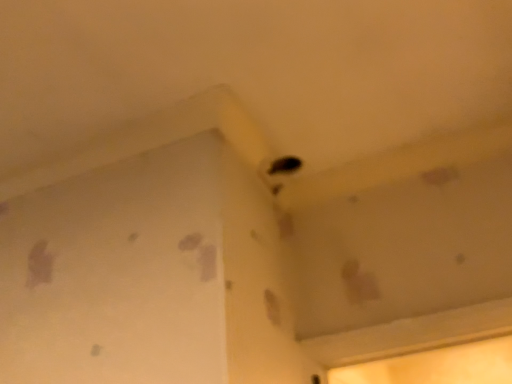
Image resolution: width=512 pixels, height=384 pixels. What do you see at coordinates (285, 165) in the screenshot?
I see `black matte hole at upper center` at bounding box center [285, 165].

In order to face black matte hole at upper center, should I rotate leftwards or rightwards?

Rotate your view right by about 4.105°.

Locate an element on the screen. black matte hole at upper center is located at coordinates (285, 165).

Locate an element on the screen. black matte hole at upper center is located at coordinates (285, 165).